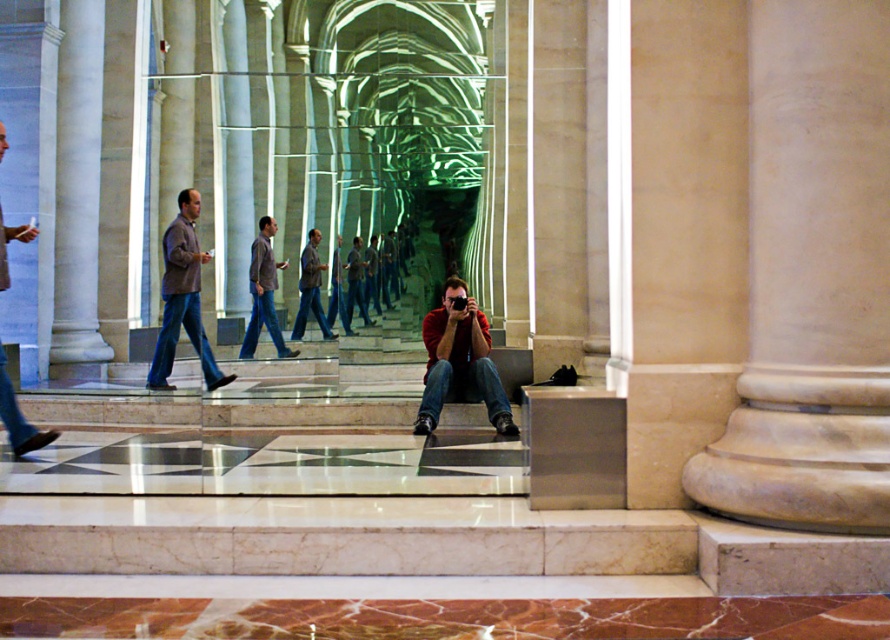
You are standing in the grand classical building and see the matte red shirt at center and the matte brown jacket at center. Which one is closer to you?

The matte red shirt at center is closer to you because it is in front of the matte brown jacket at center.